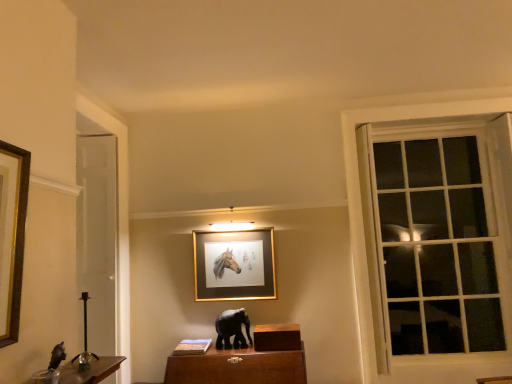
Question: Considering the relative sizes of gold/metallic picture frame at center and black glossy elephant at center, placed as the second animal when sorted from left to right, in the image provided, is gold/metallic picture frame at center bigger than black glossy elephant at center, placed as the second animal when sorted from left to right,?

Choices:
 (A) yes
 (B) no

Answer: (A)

Question: Is gold/metallic picture frame at center thinner than black glossy elephant at center, the second animal positioned from the top?

Choices:
 (A) no
 (B) yes

Answer: (B)

Question: From a real-world perspective, is gold/metallic picture frame at center positioned under black glossy elephant at center, which is the 2th animal from front to back, based on gravity?

Choices:
 (A) no
 (B) yes

Answer: (A)

Question: From the image's perspective, is gold/metallic picture frame at center located beneath black glossy elephant at center, acting as the 1th animal starting from the bottom?

Choices:
 (A) no
 (B) yes

Answer: (A)

Question: Is gold/metallic picture frame at center oriented away from black glossy elephant at center, which is the 2th animal from front to back?

Choices:
 (A) no
 (B) yes

Answer: (A)

Question: Considering the relative sizes of gold/metallic picture frame at center and black glossy elephant at center, the second animal positioned from the top, in the image provided, is gold/metallic picture frame at center shorter than black glossy elephant at center, the second animal positioned from the top,?

Choices:
 (A) no
 (B) yes

Answer: (A)

Question: Considering the relative sizes of white glass window at right and shiny black elephant at left, the 1th animal from the front, in the image provided, is white glass window at right bigger than shiny black elephant at left, the 1th animal from the front,?

Choices:
 (A) no
 (B) yes

Answer: (B)

Question: Is white glass window at right at the left side of shiny black elephant at left, the 1th animal from the front?

Choices:
 (A) yes
 (B) no

Answer: (B)

Question: Is white glass window at right further to the viewer compared to shiny black elephant at left, the 2th animal ordered from the bottom?

Choices:
 (A) no
 (B) yes

Answer: (B)

Question: Is white glass window at right not inside shiny black elephant at left, the 1th animal from the front?

Choices:
 (A) yes
 (B) no

Answer: (A)

Question: From a real-world perspective, is white glass window at right over shiny black elephant at left, the first animal from the left?

Choices:
 (A) no
 (B) yes

Answer: (B)

Question: From the image's perspective, is white glass window at right over shiny black elephant at left, the 1th animal in the top-to-bottom sequence?

Choices:
 (A) yes
 (B) no

Answer: (A)

Question: From a real-world perspective, is shiny black elephant at left, the 2th animal ordered from the bottom, physically above gold/metallic picture frame at center?

Choices:
 (A) yes
 (B) no

Answer: (B)